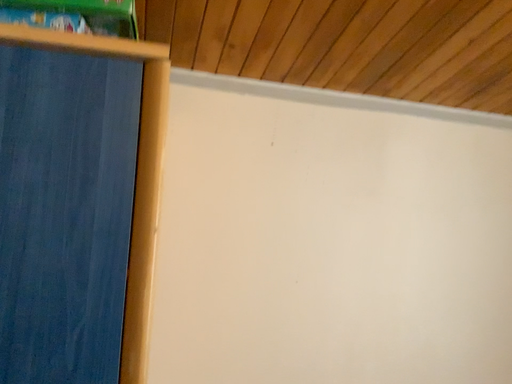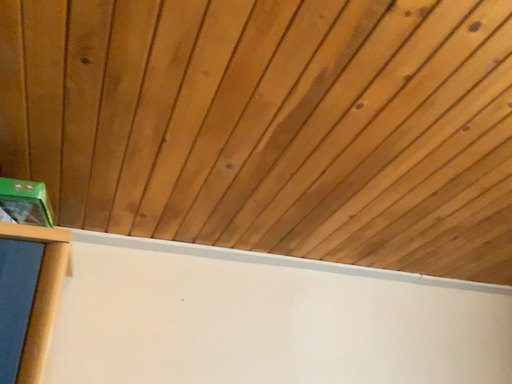
Question: Which way did the camera rotate in the video?

Choices:
 (A) rotated right
 (B) rotated left

Answer: (A)